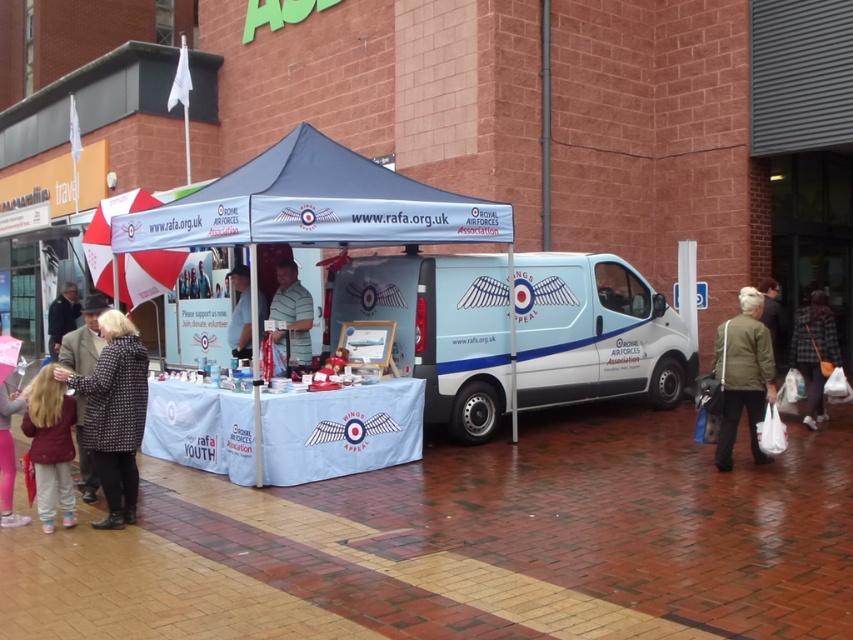
Is khaki fabric jacket at lower right shorter than green striped shirt at center?

In fact, khaki fabric jacket at lower right may be taller than green striped shirt at center.

This screenshot has height=640, width=853. Find the location of `khaki fabric jacket at lower right`. khaki fabric jacket at lower right is located at coordinates (743, 376).

Between point (737, 340) and point (294, 337), which one is positioned behind?

The point (294, 337) is more distant.

At what (x,y) coordinates should I click in order to perform the action: click on khaki fabric jacket at lower right. Please return your answer as a coordinate pair (x, y). This screenshot has width=853, height=640. Looking at the image, I should click on (743, 376).

Who is lower down, patterned coat at center or light brown hair at lower left?

Positioned lower is light brown hair at lower left.

Which is in front, point (131, 368) or point (65, 499)?

Positioned in front is point (131, 368).

Is point (115, 468) positioned before point (51, 436)?

No.

You are a GUI agent. You are given a task and a screenshot of the screen. Output one action in this format:
    pyautogui.click(x=<x>, y=<y>)
    Task: Click on the patterned coat at center
    
    Given the screenshot: What is the action you would take?
    pyautogui.click(x=114, y=413)

Looking at this image, between white glossy van at center and light brown hair at lower left, which one appears on the right side from the viewer's perspective?

Positioned to the right is white glossy van at center.

Between white glossy van at center and light brown hair at lower left, which one has more height?

Standing taller between the two is white glossy van at center.

Image resolution: width=853 pixels, height=640 pixels. I want to click on white glossy van at center, so click(595, 332).